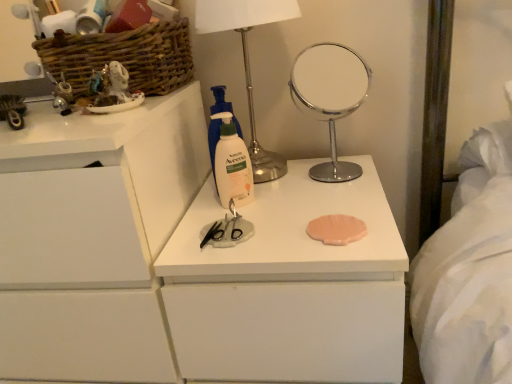
What are the coordinates of `free point in front of white matte aveeno lotion at center` in the screenshot? It's located at (x=254, y=246).